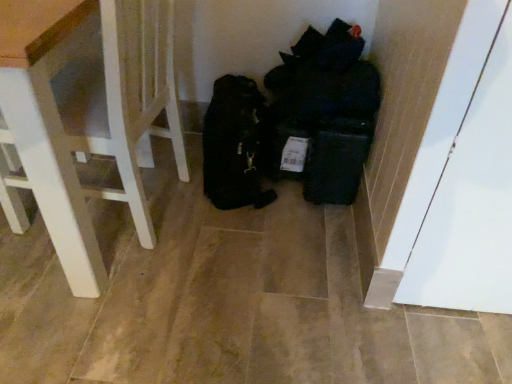
Measure the distance between black fabric bags at center and camera.

They are 1.31 meters apart.

At what (x,y) coordinates should I click in order to perform the action: click on black fabric bags at center. Please return your answer as a coordinate pair (x, y). Looking at the image, I should click on 294,123.

What do you see at coordinates (294, 123) in the screenshot? The height and width of the screenshot is (384, 512). I see `black fabric bags at center` at bounding box center [294, 123].

Locate an element on the screen. white wood chair at left is located at coordinates (85, 115).

What do you see at coordinates (85, 115) in the screenshot? The width and height of the screenshot is (512, 384). I see `white wood chair at left` at bounding box center [85, 115].

Identify the location of black fabric bags at center. (294, 123).

Between black fabric bags at center and white wood chair at left, which one appears on the right side from the viewer's perspective?

From the viewer's perspective, black fabric bags at center appears more on the right side.

Consider the image. Considering the relative positions of black fabric bags at center and white wood chair at left in the image provided, is black fabric bags at center in front of white wood chair at left?

No, it is behind white wood chair at left.

Between point (276, 90) and point (67, 118), which one is positioned in front?

The point (67, 118) is more forward.

From the image's perspective, is black fabric bags at center below white wood chair at left?

No.

From a real-world perspective, is black fabric bags at center positioned under white wood chair at left based on gravity?

Yes.

Does black fabric bags at center have a lesser width compared to white wood chair at left?

Yes.

Is black fabric bags at center taller or shorter than white wood chair at left?

In the image, black fabric bags at center appears to be shorter than white wood chair at left.

Can you confirm if black fabric bags at center is bigger than white wood chair at left?

Incorrect, black fabric bags at center is not larger than white wood chair at left.

Is black fabric bags at center inside or outside of white wood chair at left?

The correct answer is: outside.

Is black fabric bags at center not close to white wood chair at left?

black fabric bags at center is near white wood chair at left, not far away.

Is black fabric bags at center aimed at white wood chair at left?

No, black fabric bags at center is not turned towards white wood chair at left.

Can you tell me how much black fabric bags at center and white wood chair at left differ in facing direction?

90.4 degrees separate the facing orientations of black fabric bags at center and white wood chair at left.

Where is `furniture that appears on the left of black fabric bags at center`? furniture that appears on the left of black fabric bags at center is located at coordinates (85, 115).

Can you confirm if white wood chair at left is positioned to the left of black fabric bags at center?

Correct, you'll find white wood chair at left to the left of black fabric bags at center.

Which is in front, white wood chair at left or black fabric bags at center?

Positioned in front is white wood chair at left.

Considering the points (71, 270) and (248, 175), which point is behind, point (71, 270) or point (248, 175)?

The point (248, 175) is farther.

From the image's perspective, would you say white wood chair at left is shown under black fabric bags at center?

Indeed, from the image's perspective, white wood chair at left is shown beneath black fabric bags at center.

From a real-world perspective, who is located lower, white wood chair at left or black fabric bags at center?

black fabric bags at center, from a real-world perspective.

Does white wood chair at left have a lesser width compared to black fabric bags at center?

In fact, white wood chair at left might be wider than black fabric bags at center.

Who is shorter, white wood chair at left or black fabric bags at center?

With less height is black fabric bags at center.

Considering the relative sizes of white wood chair at left and black fabric bags at center in the image provided, is white wood chair at left smaller than black fabric bags at center?

No, white wood chair at left is not smaller than black fabric bags at center.

Is black fabric bags at center completely or partially inside white wood chair at left?

No, black fabric bags at center is not surrounded by white wood chair at left.

Is white wood chair at left with black fabric bags at center?

No.

Is white wood chair at left looking in the opposite direction of black fabric bags at center?

white wood chair at left does not have its back to black fabric bags at center.

How many degrees apart are the facing directions of white wood chair at left and black fabric bags at center?

There is a 90.4-degree angle between the facing directions of white wood chair at left and black fabric bags at center.

The height and width of the screenshot is (384, 512). In order to click on furniture in front of the black fabric bags at center in this screenshot , I will do `click(85, 115)`.

Where is `garbage behind the white wood chair at left`? Image resolution: width=512 pixels, height=384 pixels. garbage behind the white wood chair at left is located at coordinates pos(294,123).

Find the location of a particular element. This screenshot has width=512, height=384. garbage directly beneath the white wood chair at left (from a real-world perspective) is located at coordinates point(294,123).